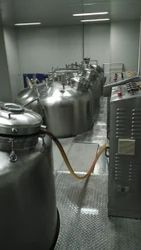
The width and height of the screenshot is (141, 250). What are the coordinates of `reflection of the fluorescent lights` in the screenshot? It's located at (103, 123), (99, 139), (99, 166), (79, 173), (89, 211).